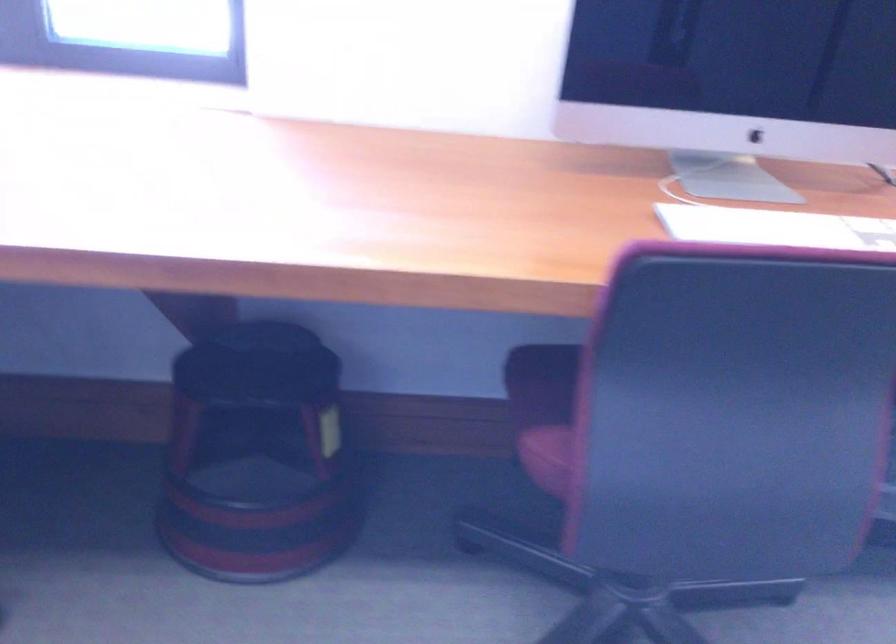
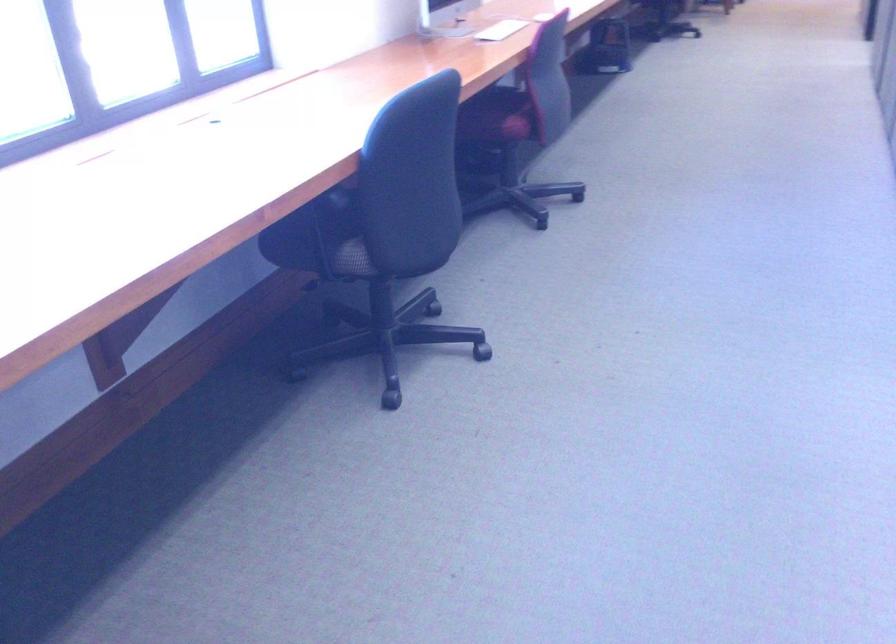
Where in the second image is the point corresponding to point 724,232 from the first image?

(501, 30)